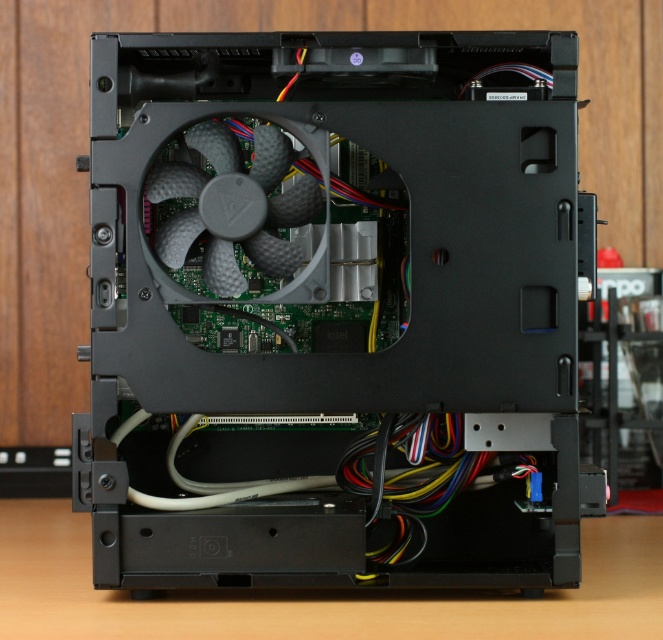
Find the location of a particular element. This screenshot has height=640, width=663. black plastic fan at center is located at coordinates (333, 307).

Which is above, black plastic fan at center or gray matte fan at center?

Positioned higher is gray matte fan at center.

Which is in front, point (278, 296) or point (272, 253)?

Positioned in front is point (278, 296).

You are a GUI agent. You are given a task and a screenshot of the screen. Output one action in this format:
    pyautogui.click(x=<x>, y=<y>)
    Task: Click on the black plastic fan at center
    The width and height of the screenshot is (663, 640).
    Given the screenshot: What is the action you would take?
    pyautogui.click(x=333, y=307)